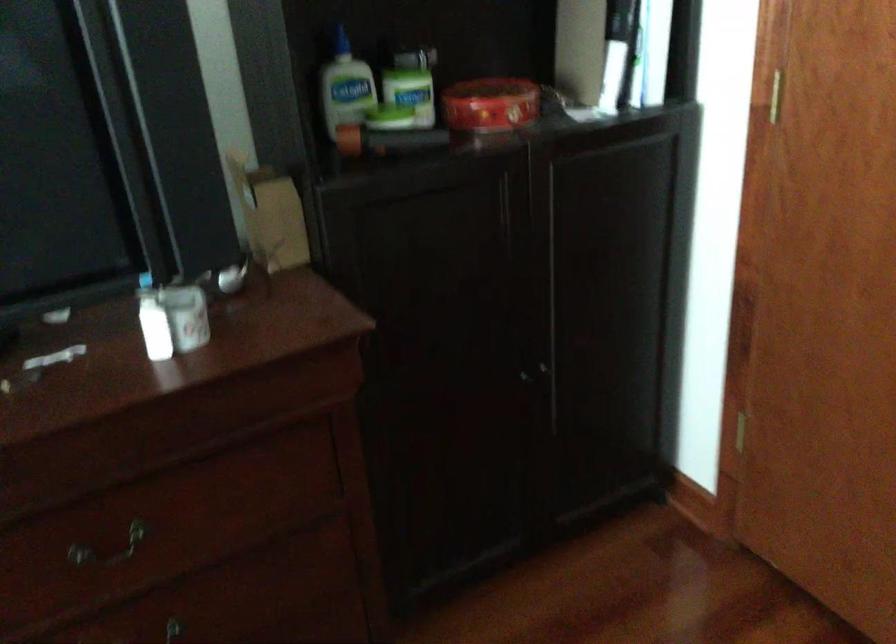
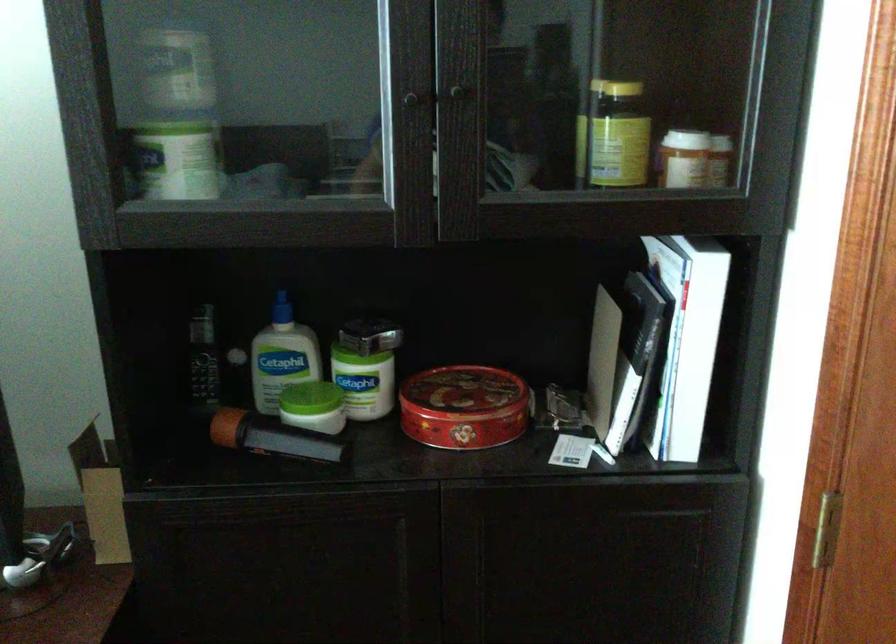
In the second image, find the point that corresponds to [676,169] in the first image.

(707, 554)